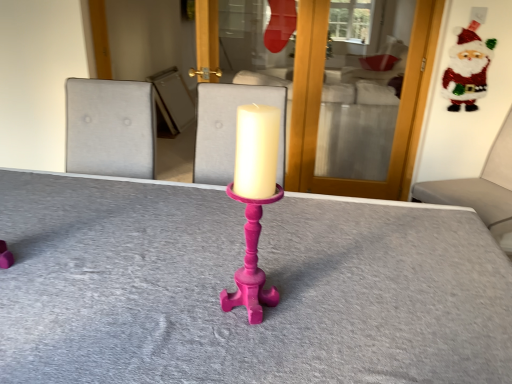
Question: Is shiny glitter santa at upper right in front of or behind matte pink candle holder at center in the image?

Choices:
 (A) behind
 (B) front

Answer: (A)

Question: From the image's perspective, is shiny glitter santa at upper right above or below matte pink candle holder at center?

Choices:
 (A) below
 (B) above

Answer: (B)

Question: Based on their relative distances, which object is farther from the velvet grey cushion at right?

Choices:
 (A) matte pink candlestick at center
 (B) shiny glitter santa at upper right
 (C) matte pink candle holder at center

Answer: (C)

Question: Estimate the real-world distances between objects in this image. Which object is farther from the matte pink candle holder at center?

Choices:
 (A) shiny glitter santa at upper right
 (B) matte pink candlestick at center
 (C) velvet grey cushion at right

Answer: (A)